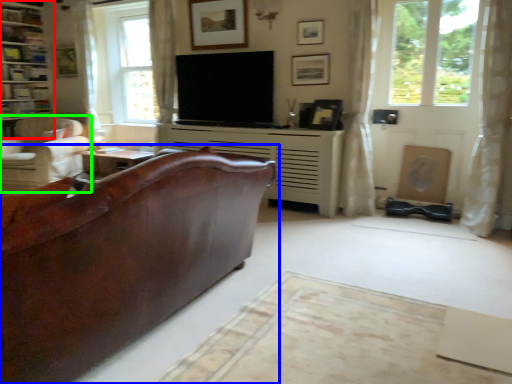
Question: Considering the real-world distances, which object is closest to tv cabinet (highlighted by a red box)? studio couch (highlighted by a blue box) or chair (highlighted by a green box).

Choices:
 (A) studio couch
 (B) chair

Answer: (B)